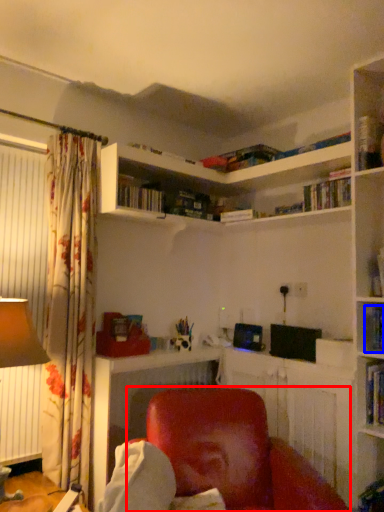
Question: Which of the following is the farthest to the observer, chair (highlighted by a red box) or book (highlighted by a blue box)?

Choices:
 (A) chair
 (B) book

Answer: (B)